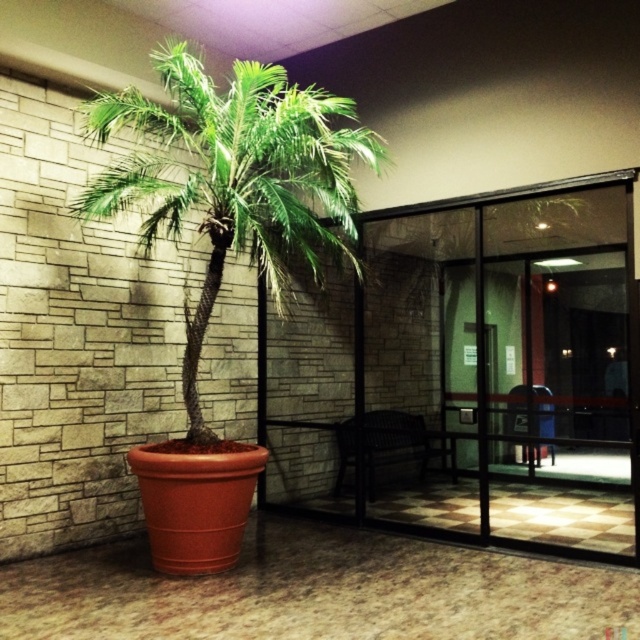
You are a delivery person trying to enter the lobby through the transparent glass door at center. There is a green leafy palm tree at center blocking your path. Can you walk around it to reach the door?

The green leafy palm tree at center is behind the transparent glass door at center, so it is not blocking your path. You can walk straight to the door without any obstruction.

You are moving a large potted plant that is 1.2 meters wide. You need to move it through the transparent glass door at center. The green leafy palm tree at center is currently blocking the doorway. Can you move the plant through the door without damaging it?

The transparent glass door at center might be wider than the green leafy palm tree at center. Since the palm tree is blocking the doorway, you should first move it aside. Once the tree is moved, the door might be wide enough to allow the 1.2 meter wide plant through without damage, provided the door width exceeds the plant width.

You are standing at the entrance of the lobby and see two points marked on the floor. The first point is at coordinate point (x=563, y=349) and the second is at point (x=314, y=104). If you want to walk towards the glass door with black framing, which point should you step on first?

Point (x=314, y=104) should be stepped on first because point (x=563, y=349) is behind it, so stepping on the latter would require passing through the former first.